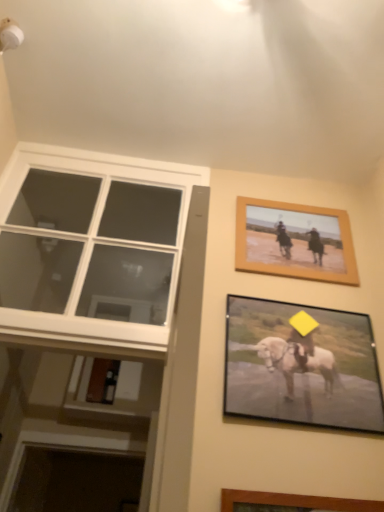
Question: Is matte black picture frame at lower right, the first picture frame positioned from the front, bigger than white glass window at left?

Choices:
 (A) no
 (B) yes

Answer: (A)

Question: Does matte black picture frame at lower right, arranged as the 1th picture frame when ordered from the bottom, have a lesser height compared to white glass window at left?

Choices:
 (A) yes
 (B) no

Answer: (A)

Question: Is white glass window at left surrounded by matte black picture frame at lower right, arranged as the 1th picture frame when ordered from the bottom?

Choices:
 (A) no
 (B) yes

Answer: (A)

Question: Is matte black picture frame at lower right, the first picture frame positioned from the front, positioned in front of white glass window at left?

Choices:
 (A) no
 (B) yes

Answer: (B)

Question: From the image's perspective, would you say matte black picture frame at lower right, arranged as the 1th picture frame when ordered from the bottom, is shown under white glass window at left?

Choices:
 (A) yes
 (B) no

Answer: (A)

Question: Considering the positions of point tap(271, 258) and point tap(31, 169), is point tap(271, 258) closer or farther from the camera than point tap(31, 169)?

Choices:
 (A) closer
 (B) farther

Answer: (A)

Question: From a real-world perspective, relative to white glass window at left, is wooden framed picture at upper right, the second picture frame from the front, vertically above or below?

Choices:
 (A) below
 (B) above

Answer: (B)

Question: From the image's perspective, relative to white glass window at left, is wooden framed picture at upper right, placed as the 2th picture frame when sorted from bottom to top, above or below?

Choices:
 (A) above
 (B) below

Answer: (B)

Question: In terms of size, does wooden framed picture at upper right, placed as the 2th picture frame when sorted from bottom to top, appear bigger or smaller than white glass window at left?

Choices:
 (A) small
 (B) big

Answer: (A)

Question: In terms of width, does matte black picture frame at lower right, the second picture frame in the top-to-bottom sequence, look wider or thinner when compared to white glass window at left?

Choices:
 (A) wide
 (B) thin

Answer: (B)

Question: From their relative heights in the image, would you say matte black picture frame at lower right, the second picture frame in the top-to-bottom sequence, is taller or shorter than white glass window at left?

Choices:
 (A) short
 (B) tall

Answer: (A)

Question: From the image's perspective, is matte black picture frame at lower right, the first picture frame positioned from the front, located above or below white glass window at left?

Choices:
 (A) below
 (B) above

Answer: (A)

Question: Relative to white glass window at left, is matte black picture frame at lower right, the second picture frame in the top-to-bottom sequence, in front or behind?

Choices:
 (A) behind
 (B) front

Answer: (B)

Question: Looking at the image, does white glass window at left seem bigger or smaller compared to wooden framed picture at upper right, the first picture frame viewed from the top?

Choices:
 (A) small
 (B) big

Answer: (B)

Question: From the image's perspective, is white glass window at left above or below wooden framed picture at upper right, the first picture frame viewed from the top?

Choices:
 (A) below
 (B) above

Answer: (B)